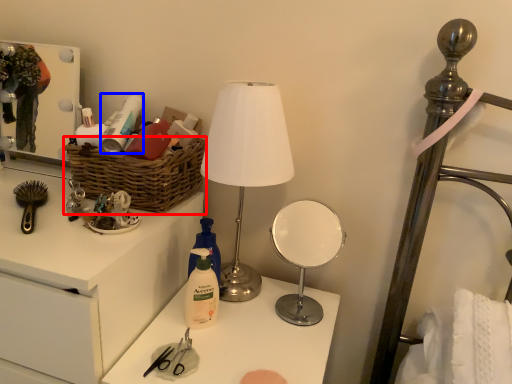
Question: Among these objects, which one is farthest to the camera, basket (highlighted by a red box) or toiletry (highlighted by a blue box)?

Choices:
 (A) basket
 (B) toiletry

Answer: (B)